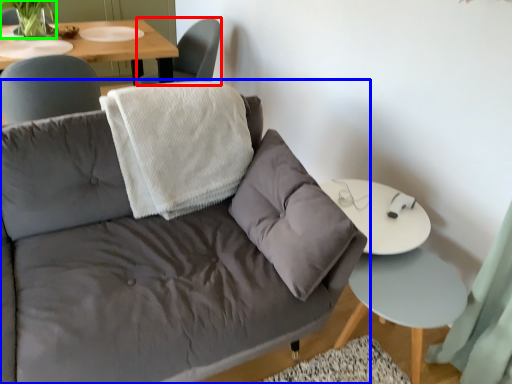
Question: Considering the real-world distances, which object is closest to chair (highlighted by a red box)? studio couch (highlighted by a blue box) or plant (highlighted by a green box).

Choices:
 (A) studio couch
 (B) plant

Answer: (B)